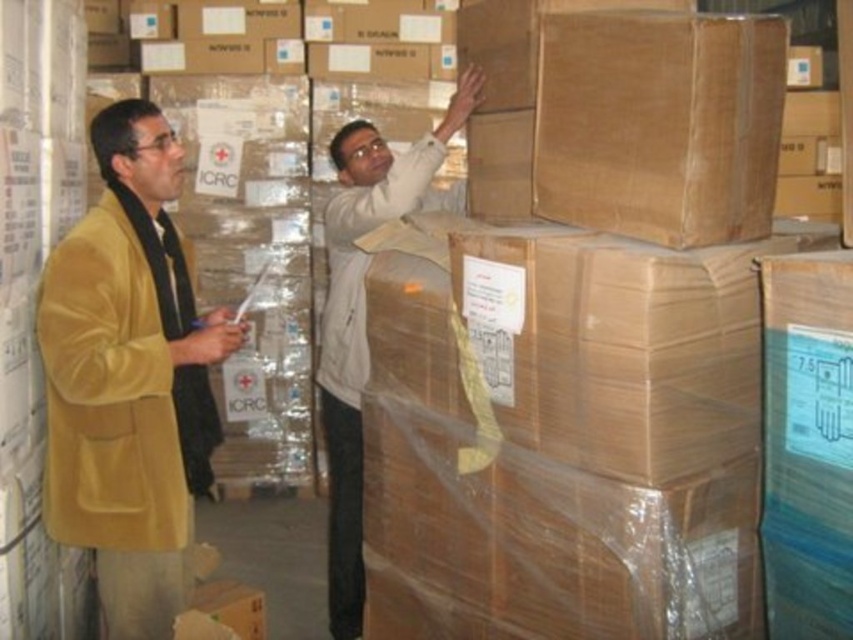
Question: Does velvet gold coat at left have a greater width compared to white matte jacket at upper center?

Choices:
 (A) yes
 (B) no

Answer: (A)

Question: Which point is farther to the camera?

Choices:
 (A) (421, 188)
 (B) (170, 611)
 (C) (408, 186)

Answer: (A)

Question: Is velvet gold coat at left smaller than light beige fabric shirt at upper center?

Choices:
 (A) yes
 (B) no

Answer: (A)

Question: Is light beige fabric shirt at upper center smaller than white matte jacket at upper center?

Choices:
 (A) yes
 (B) no

Answer: (B)

Question: Which point is farther to the camera?

Choices:
 (A) velvet gold coat at left
 (B) white matte jacket at upper center
 (C) light beige fabric shirt at upper center

Answer: (B)

Question: Which point appears farthest from the camera in this image?

Choices:
 (A) (387, 177)
 (B) (349, 173)
 (C) (119, 512)

Answer: (B)